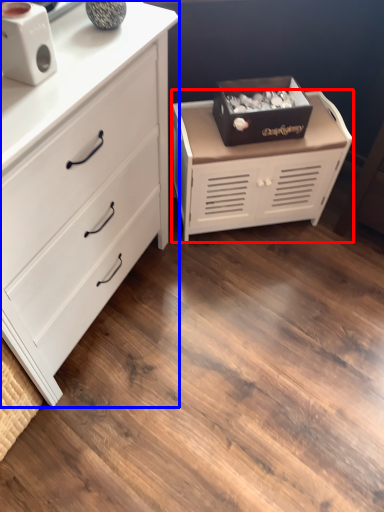
Question: Which of the following is the closest to the observer, chest of drawers (highlighted by a red box) or chest of drawers (highlighted by a blue box)?

Choices:
 (A) chest of drawers
 (B) chest of drawers

Answer: (B)